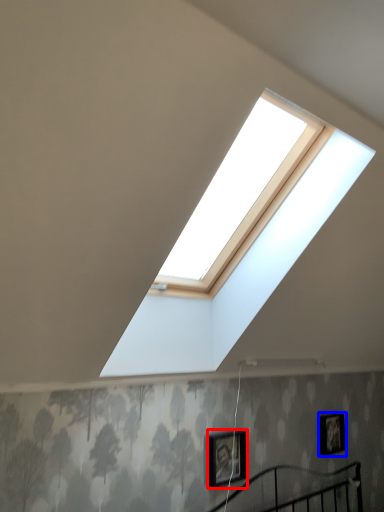
Question: Which point is further to the camera, picture frame (highlighted by a red box) or picture frame (highlighted by a blue box)?

Choices:
 (A) picture frame
 (B) picture frame

Answer: (B)